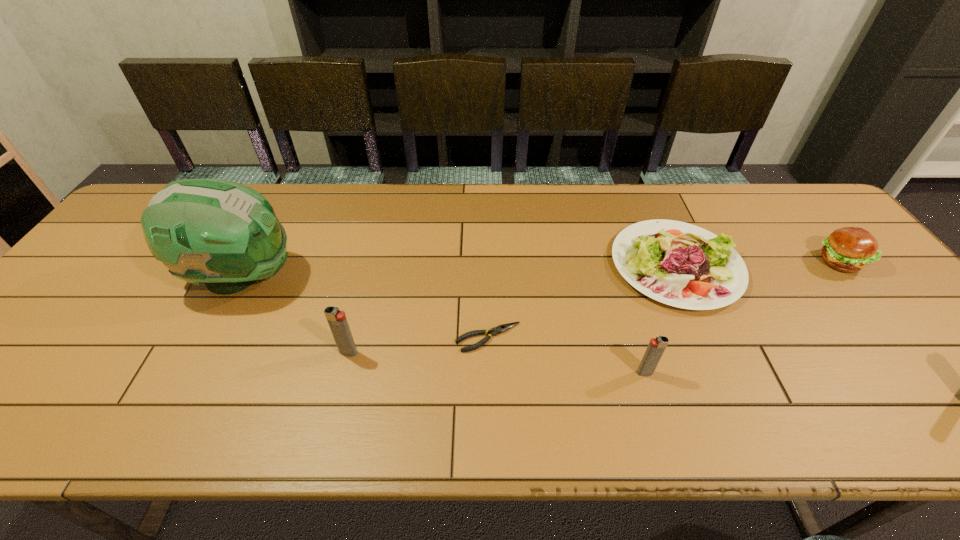
I want to click on empty space between the rightmost object and the leftmost object, so click(540, 269).

Identify the location of vacant area that lies between the shortest object and the leftmost object. The width and height of the screenshot is (960, 540). (365, 307).

Point out which object is positioned as the third nearest to the fourth shortest object. Please provide its 2D coordinates. Your answer should be formatted as a tuple, i.e. [(x, y)], where the tuple contains the x and y coordinates of a point satisfying the conditions above.

[(850, 249)]

Locate which object ranks in proximity to the fourth object from right to left. Please provide its 2D coordinates. Your answer should be formatted as a tuple, i.e. [(x, y)], where the tuple contains the x and y coordinates of a point satisfying the conditions above.

[(337, 321)]

Select which igniter is the second closest to the football helmet. Please provide its 2D coordinates. Your answer should be formatted as a tuple, i.e. [(x, y)], where the tuple contains the x and y coordinates of a point satisfying the conditions above.

[(656, 347)]

Identify which igniter is the second closest to the football helmet. Please provide its 2D coordinates. Your answer should be formatted as a tuple, i.e. [(x, y)], where the tuple contains the x and y coordinates of a point satisfying the conditions above.

[(656, 347)]

Locate an element on the screen. Image resolution: width=960 pixels, height=540 pixels. free point that satisfies the following two spatial constraints: 1. on the visor of the tallest object; 2. on the right side of the left igniter is located at coordinates (203, 352).

The height and width of the screenshot is (540, 960). Identify the location of free spot that satisfies the following two spatial constraints: 1. on the back side of the second shortest object; 2. on the left side of the pliers. (487, 266).

Find the location of a particular element. free space that satisfies the following two spatial constraints: 1. on the visor of the leftmost object; 2. on the right side of the right igniter is located at coordinates (192, 373).

At what (x,y) coordinates should I click in order to perform the action: click on free space that satisfies the following two spatial constraints: 1. on the back side of the pliers; 2. on the left side of the third shortest object. Please return your answer as a coordinate pair (x, y). The width and height of the screenshot is (960, 540). Looking at the image, I should click on (487, 261).